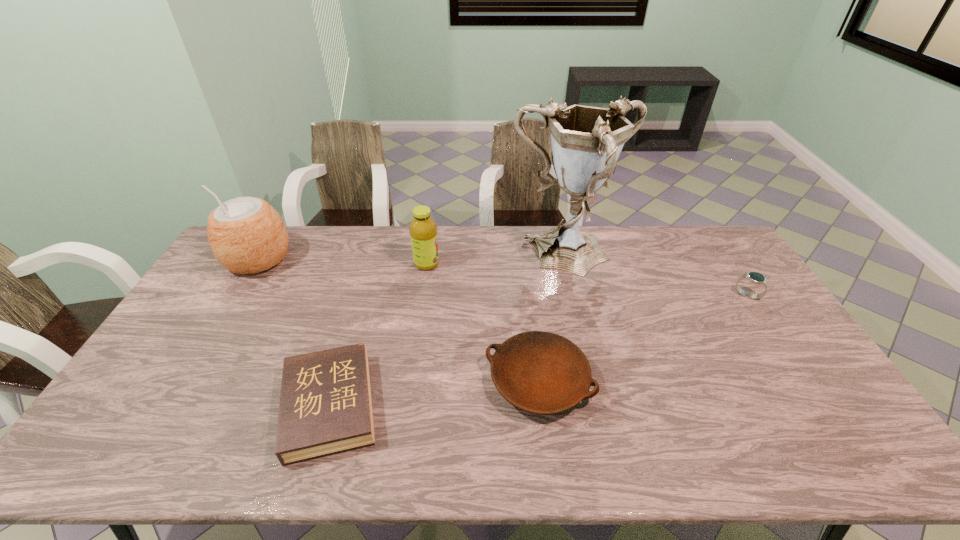
You are a GUI agent. You are given a task and a screenshot of the screen. Output one action in this format:
    pyautogui.click(x=<x>, y=<y>)
    Task: Click on the object that is at the right edge
    This screenshot has height=540, width=960.
    Given the screenshot: What is the action you would take?
    pyautogui.click(x=754, y=277)

The height and width of the screenshot is (540, 960). In order to click on object located at the far left corner in this screenshot , I will do `click(246, 234)`.

At what (x,y) coordinates should I click in order to perform the action: click on vacant area at the far edge. Please return your answer as a coordinate pair (x, y). The height and width of the screenshot is (540, 960). Looking at the image, I should click on (476, 257).

I want to click on vacant area at the near edge, so click(x=588, y=466).

You are a GUI agent. You are given a task and a screenshot of the screen. Output one action in this format:
    pyautogui.click(x=<x>, y=<y>)
    Task: Click on the blank space at the right edge of the desktop
    The image size is (960, 540).
    Given the screenshot: What is the action you would take?
    pos(793,414)

Identify the location of free region at the far right corner of the desktop. Image resolution: width=960 pixels, height=540 pixels. click(695, 246).

This screenshot has height=540, width=960. In order to click on free space between the fruit juice and the shortest object in this screenshot , I will do `click(378, 335)`.

Find the location of a particular element. The image size is (960, 540). empty space between the watch and the coconut is located at coordinates (503, 278).

At what (x,y) coordinates should I click in order to perform the action: click on vacant region between the plate and the watch. Please return your answer as a coordinate pair (x, y). Image resolution: width=960 pixels, height=540 pixels. Looking at the image, I should click on (643, 338).

Locate an element on the screen. This screenshot has width=960, height=540. vacant area that lies between the plate and the leftmost object is located at coordinates (398, 320).